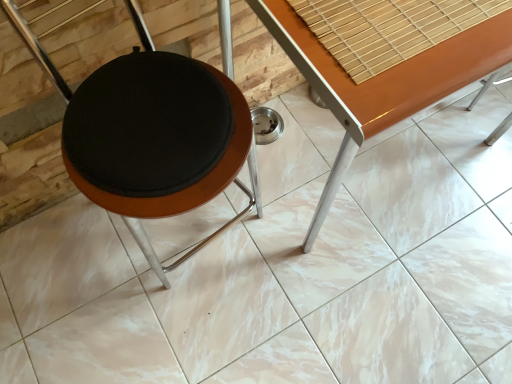
Image resolution: width=512 pixels, height=384 pixels. What do you see at coordinates (383, 82) in the screenshot?
I see `wooden glossy table at center` at bounding box center [383, 82].

Locate an element on the screen. wooden glossy table at center is located at coordinates (383, 82).

What do you see at coordinates (188, 186) in the screenshot? I see `matte black stool at center` at bounding box center [188, 186].

I want to click on matte black stool at center, so click(x=188, y=186).

The width and height of the screenshot is (512, 384). Identify the location of wooden glossy table at center. (383, 82).

Considering the relative positions of wooden glossy table at center and matte black stool at center in the image provided, is wooden glossy table at center to the left or to the right of matte black stool at center?

Based on their positions, wooden glossy table at center is located to the right of matte black stool at center.

Which object is further away from the camera taking this photo, wooden glossy table at center or matte black stool at center?

wooden glossy table at center is further from the camera.

Considering the positions of points (413, 61) and (98, 199), is point (413, 61) closer to camera compared to point (98, 199)?

Yes, it is.

In the scene shown: From the image's perspective, is wooden glossy table at center located beneath matte black stool at center?

No, from the image's perspective, wooden glossy table at center is not below matte black stool at center.

From a real-world perspective, is wooden glossy table at center positioned under matte black stool at center based on gravity?

Yes, from a real-world perspective, wooden glossy table at center is beneath matte black stool at center.

Is wooden glossy table at center wider than matte black stool at center?

Indeed, wooden glossy table at center has a greater width compared to matte black stool at center.

Considering the sizes of wooden glossy table at center and matte black stool at center in the image, is wooden glossy table at center taller or shorter than matte black stool at center?

Clearly, wooden glossy table at center is shorter compared to matte black stool at center.

Between wooden glossy table at center and matte black stool at center, which one has larger size?

wooden glossy table at center is bigger.

Can we say wooden glossy table at center lies outside matte black stool at center?

Indeed, wooden glossy table at center is completely outside matte black stool at center.

Is wooden glossy table at center not close to matte black stool at center?

That's not correct — wooden glossy table at center is a little close to matte black stool at center.

Is wooden glossy table at center oriented towards matte black stool at center?

No.

Identify the location of furniture lying in front of the wooden glossy table at center. (188, 186).

Can you confirm if matte black stool at center is positioned to the left of wooden glossy table at center?

Correct, you'll find matte black stool at center to the left of wooden glossy table at center.

Relative to wooden glossy table at center, is matte black stool at center in front or behind?

Visually, matte black stool at center is located in front of wooden glossy table at center.

Is point (150, 254) in front of point (288, 49)?

That is False.

From the image's perspective, is matte black stool at center above wooden glossy table at center?

Actually, matte black stool at center appears below wooden glossy table at center in the image.

From a real-world perspective, is matte black stool at center located higher than wooden glossy table at center?

Yes, from a real-world perspective, matte black stool at center is over wooden glossy table at center

Between matte black stool at center and wooden glossy table at center, which one has larger width?

wooden glossy table at center.

Who is taller, matte black stool at center or wooden glossy table at center?

With more height is matte black stool at center.

Which of these two, matte black stool at center or wooden glossy table at center, is bigger?

Bigger between the two is wooden glossy table at center.

Is matte black stool at center inside the boundaries of wooden glossy table at center, or outside?

The correct answer is: outside.

Would you consider matte black stool at center to be distant from wooden glossy table at center?

matte black stool at center is actually quite close to wooden glossy table at center.

Does matte black stool at center turn towards wooden glossy table at center?

No, matte black stool at center is not facing towards wooden glossy table at center.

How many degrees apart are the facing directions of matte black stool at center and wooden glossy table at center?

7.08 degrees separate the facing orientations of matte black stool at center and wooden glossy table at center.

How much distance is there between matte black stool at center and wooden glossy table at center?

→ A distance of 14.13 inches exists between matte black stool at center and wooden glossy table at center.

Locate an element on the screen. The image size is (512, 384). furniture that is below the wooden glossy table at center (from the image's perspective) is located at coordinates (188, 186).

At what (x,y) coordinates should I click in order to perform the action: click on table on the right of matte black stool at center. Please return your answer as a coordinate pair (x, y). Image resolution: width=512 pixels, height=384 pixels. Looking at the image, I should click on (383, 82).

Identify the location of table located behind the matte black stool at center. This screenshot has height=384, width=512. (383, 82).